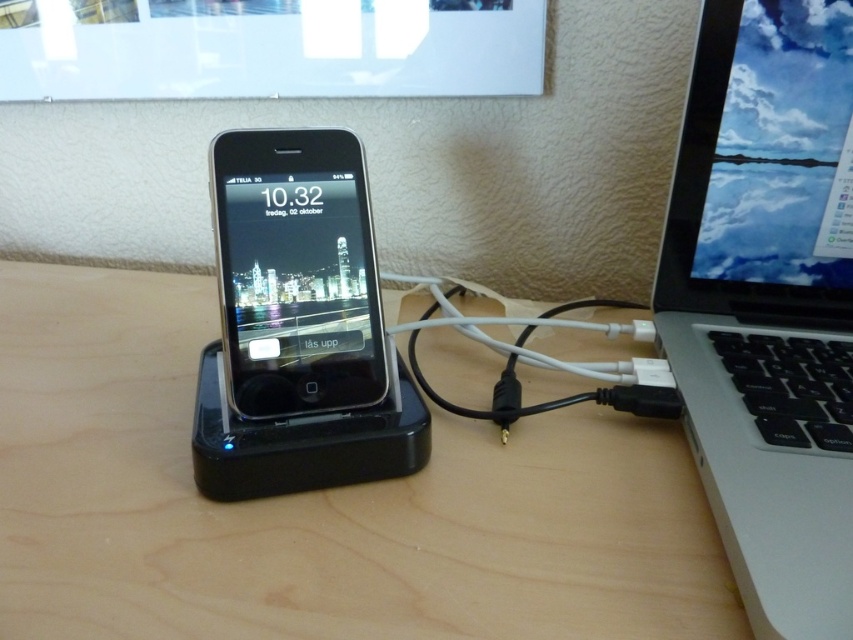
You have a black glossy ipod at center and a camera. The distance between them is crucial for a photo shoot. If the minimum required distance for the camera to focus properly is 18 inches, will the current setup work?

The black glossy ipod at center and camera are 17.91 inches apart from each other, which is just below the minimum required 18 inches. Therefore, the camera may not focus properly at this distance.

You are standing in front of a workspace with a smartphone docked into a charging station and a laptop partially visible to the right. There is a specific point at coordinates point (x=149, y=380). If you want to place a 12 inch wide object on the workspace, will it fit between the smartphone and the laptop without overlapping either?

The distance between point (x=149, y=380) and the viewer is 23.25 inches. Since the object is only 12 inches wide, it should fit comfortably between the smartphone and the laptop without overlapping either.